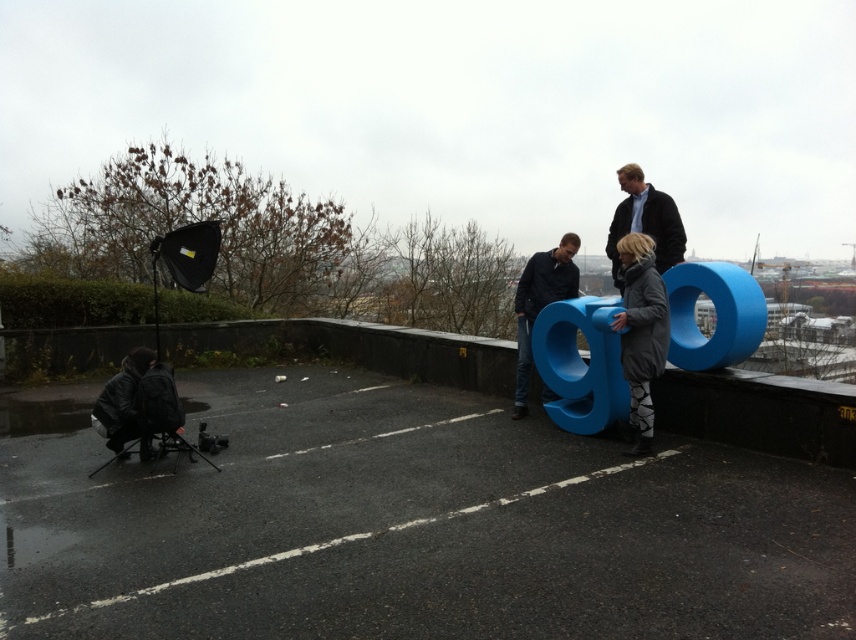
You are a photographer who just arrived at the rooftop location. You see the black asphalt parking lot at lower left and the leather jacket at lower left. Which object is wider?

The leather jacket at lower left is wider because the black asphalt parking lot at lower left has a lesser width compared to it.